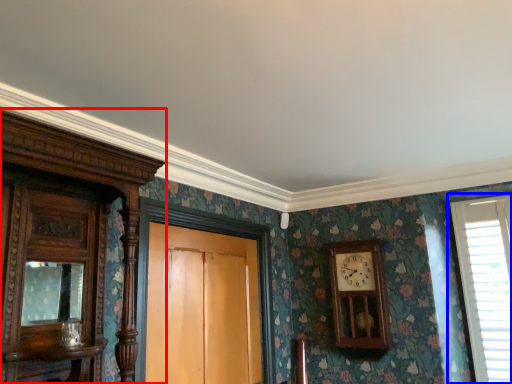
Question: Which object appears closest to the camera in this image, cabinetry (highlighted by a red box) or window (highlighted by a blue box)?

Choices:
 (A) cabinetry
 (B) window

Answer: (A)